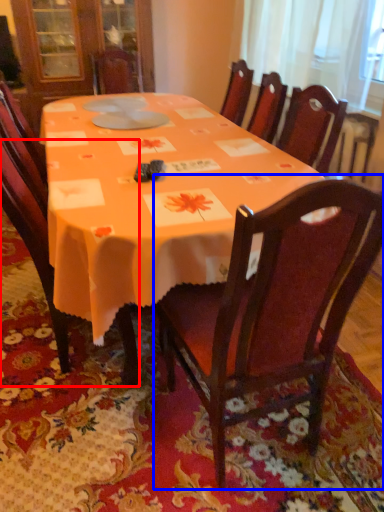
Question: Which object is closer to the camera taking this photo, chair (highlighted by a red box) or chair (highlighted by a blue box)?

Choices:
 (A) chair
 (B) chair

Answer: (B)